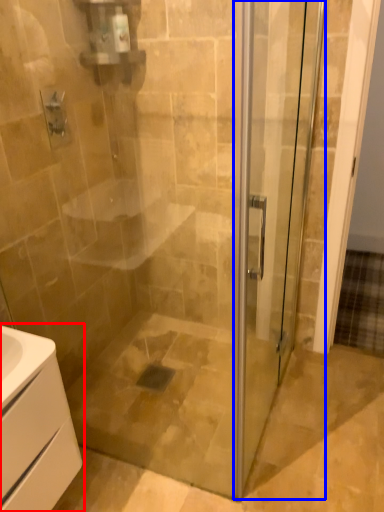
Question: Which object is further to the camera taking this photo, bathroom cabinet (highlighted by a red box) or screen door (highlighted by a blue box)?

Choices:
 (A) bathroom cabinet
 (B) screen door

Answer: (A)